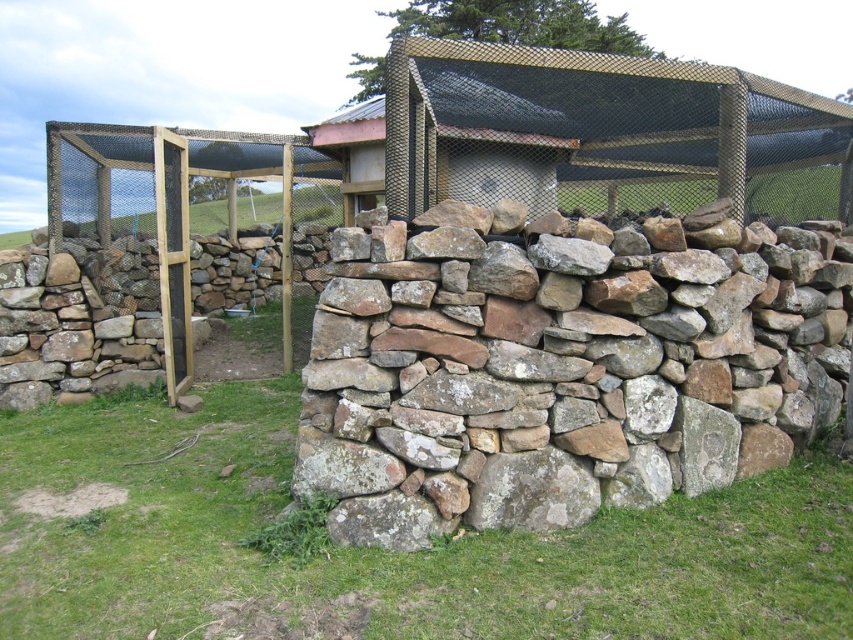
Is green grass at lower center closer to the viewer compared to wooden mesh cage at center?

Yes, it is.

Where is `green grass at lower center`? The height and width of the screenshot is (640, 853). green grass at lower center is located at coordinates (386, 552).

What do you see at coordinates (386, 552) in the screenshot? The width and height of the screenshot is (853, 640). I see `green grass at lower center` at bounding box center [386, 552].

What are the coordinates of `green grass at lower center` in the screenshot? It's located at coord(386,552).

Is natural stone wall at center taller than green grass at lower center?

Yes, natural stone wall at center is taller than green grass at lower center.

Is natural stone wall at center bigger than green grass at lower center?

Yes.

Locate an element on the screen. natural stone wall at center is located at coordinates (554, 371).

What are the coordinates of `natural stone wall at center` in the screenshot? It's located at (554, 371).

In the scene shown: Who is lower down, natural stone wall at center or metallic mesh hut at center?

natural stone wall at center is lower down.

Is natural stone wall at center positioned in front of metallic mesh hut at center?

Yes.

Identify the location of natural stone wall at center. Image resolution: width=853 pixels, height=640 pixels. (554, 371).